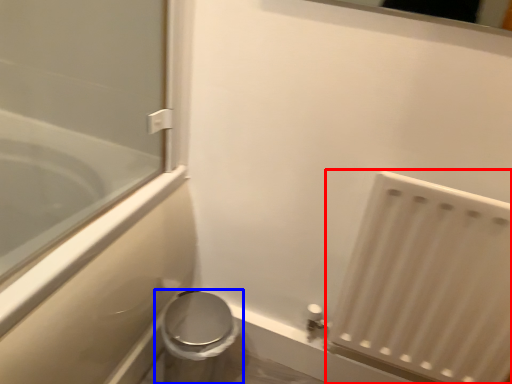
Question: Which object is closer to the camera taking this photo, radiator (highlighted by a red box) or toilet (highlighted by a blue box)?

Choices:
 (A) radiator
 (B) toilet

Answer: (A)